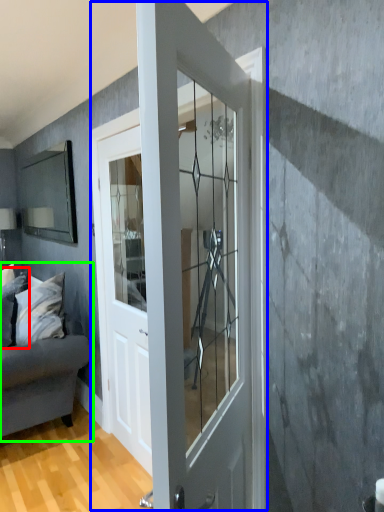
Question: Estimate the real-world distances between objects in this image. Which object is closer to pillow (highlighted by a red box), door (highlighted by a blue box) or studio couch (highlighted by a green box)?

Choices:
 (A) door
 (B) studio couch

Answer: (B)